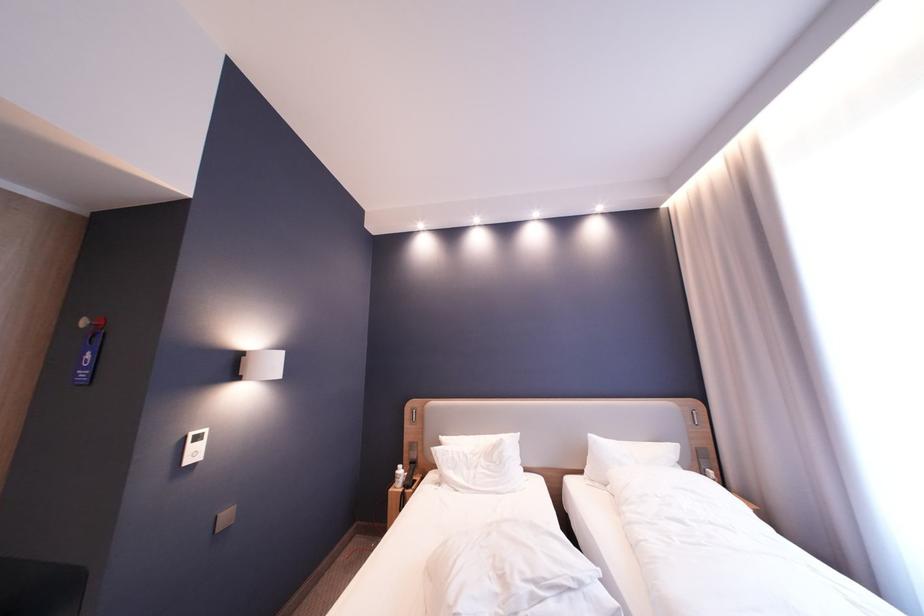
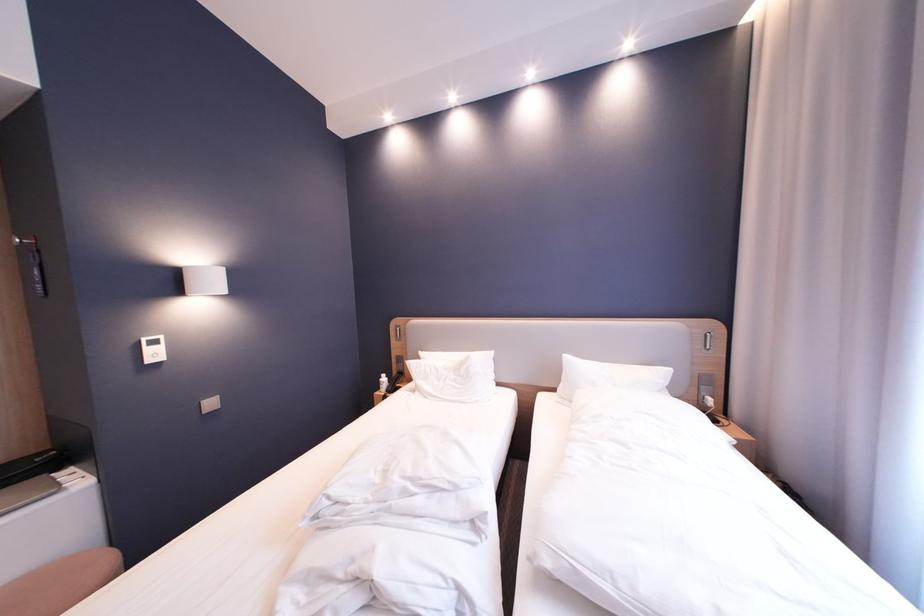
Locate, in the second image, the point that corresponds to point 700,424 in the first image.

(711, 347)